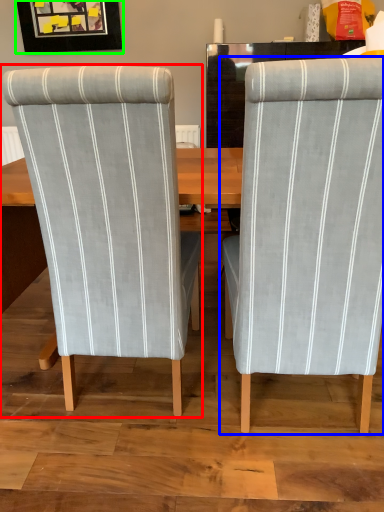
Question: Estimate the real-world distances between objects in this image. Which object is closer to chair (highlighted by a red box), chair (highlighted by a blue box) or picture frame (highlighted by a green box)?

Choices:
 (A) chair
 (B) picture frame

Answer: (A)